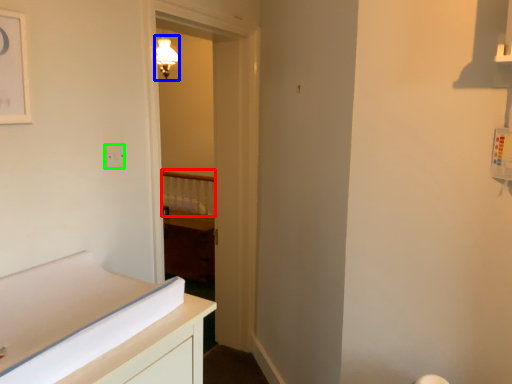
Question: Which object is positioned closest to balustrade (highlighted by a red box)? Select from light fixture (highlighted by a blue box) and electric outlet (highlighted by a green box).

Choices:
 (A) light fixture
 (B) electric outlet

Answer: (A)